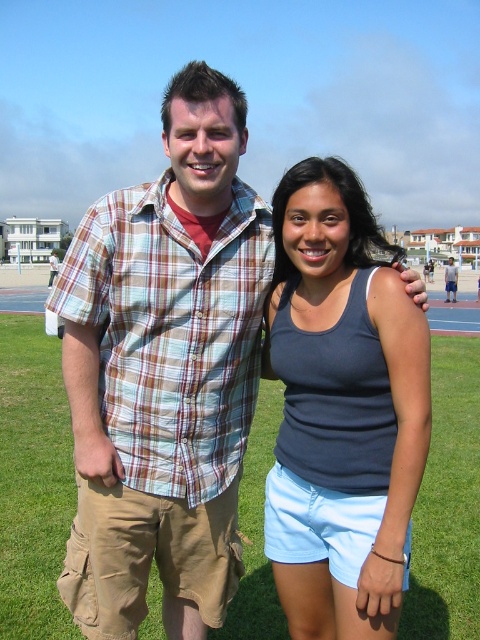
You are standing in the middle of the grassy field and want to walk to the nearest point between point (4, 522) and point (423, 268). Which point should you walk towards?

You should walk towards point (4, 522) because it is closer to you than point (423, 268).